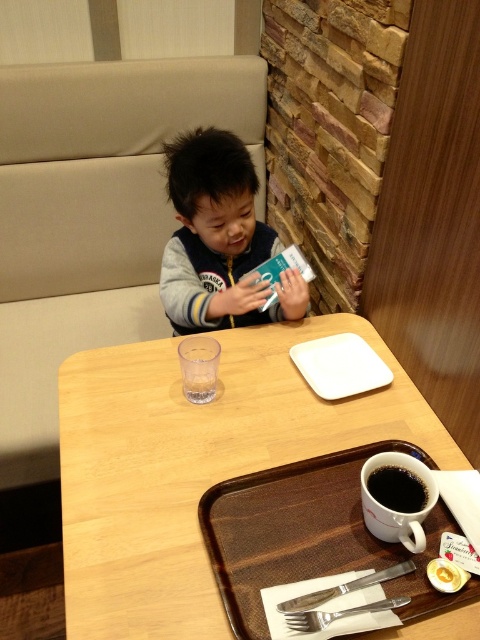
You are a barista working in the cafe and you need to place a new cup on the table. The customer has requested that the cup be placed exactly 1 meter away from the camera. The black matte cup at lower right is already on the table. Can you place the new cup next to it without moving the existing cup?

The black matte cup at lower right is currently 85.91 centimeters away from the camera. To place the new cup exactly 1 meter away, you would need to position it 14.09 centimeters further away from the camera than the existing cup. However, since the customer wants the new cup placed next to the existing one, this might not be possible without moving the existing cup.

You are a customer in a cafe and see the black matte cup at lower right and the smooth yellow egg at lower right on the table. Which item is closer to the right edge of the table?

The smooth yellow egg at lower right is closer to the right edge of the table because the black matte cup at lower right is to the left of it.

You are a waiter in a cafe and need to place a new order of cookies on the table. The cookies are on a brown textured tray at lower center. Where should you place them so they are above the black matte cup at lower right?

The brown textured tray at lower center should be placed above the black matte cup at lower right since it is currently located below it.